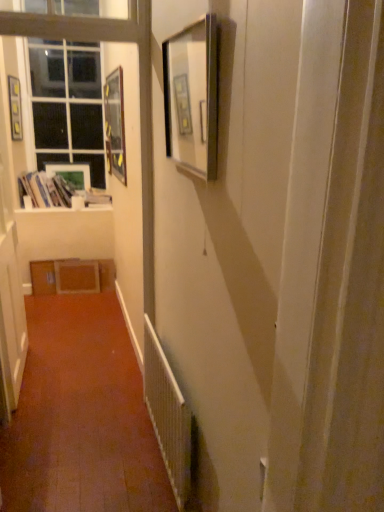
Measure the distance between white textured radiator at lower center and camera.

white textured radiator at lower center and camera are 1.67 meters apart.

Measure the distance between point [172,109] and camera.

Point [172,109] is 5.09 feet away from camera.

In the scene shown: What is the approximate height of matte wooden picture frame at upper left, positioned as the 3th picture frame in back-to-front order?

matte wooden picture frame at upper left, positioned as the 3th picture frame in back-to-front order, is 30.47 inches tall.

Measure the distance between point (10,123) and camera.

The depth of point (10,123) is 3.81 meters.

What is the approximate width of clear glass window at upper left?

The width of clear glass window at upper left is 13.43 centimeters.

What do you see at coordinates (67, 104) in the screenshot? Image resolution: width=384 pixels, height=512 pixels. I see `clear glass window at upper left` at bounding box center [67, 104].

Find the location of a particular element. The height and width of the screenshot is (512, 384). white matte door at left is located at coordinates (10, 264).

Image resolution: width=384 pixels, height=512 pixels. Find the location of `white textured radiator at lower center`. white textured radiator at lower center is located at coordinates (168, 416).

From a real-world perspective, is white glossy window sill at upper left positioned above or below matte black picture frame at upper center, arranged as the first picture frame when viewed from the right?

white glossy window sill at upper left is below matte black picture frame at upper center, arranged as the first picture frame when viewed from the right.

At what (x,y) coordinates should I click in order to perform the action: click on window sill lying below the matte black picture frame at upper center, positioned as the fourth picture frame in back-to-front order (from the image's perspective). Please return your answer as a coordinate pair (x, y). The width and height of the screenshot is (384, 512). Looking at the image, I should click on (65, 209).

Is white glossy window sill at upper left next to matte black picture frame at upper center, marked as the 4th picture frame in a left-to-right arrangement?

white glossy window sill at upper left is not next to matte black picture frame at upper center, marked as the 4th picture frame in a left-to-right arrangement, and they're not touching.

Is white glossy window sill at upper left wider or thinner than matte black picture frame at upper center, arranged as the first picture frame when viewed from the right?

white glossy window sill at upper left is wider than matte black picture frame at upper center, arranged as the first picture frame when viewed from the right.

Considering the sizes of objects matte black picture frame at upper left, the third picture frame when ordered from front to back, and matte black picture frame at upper center, arranged as the first picture frame when viewed from the right, in the image provided, who is taller, matte black picture frame at upper left, the third picture frame when ordered from front to back, or matte black picture frame at upper center, arranged as the first picture frame when viewed from the right,?

matte black picture frame at upper left, the third picture frame when ordered from front to back.

Is matte black picture frame at upper left, the third picture frame when ordered from front to back, completely or partially outside of matte black picture frame at upper center, marked as the 4th picture frame in a left-to-right arrangement?

Yes.

Is matte black picture frame at upper left, the third picture frame when ordered from front to back, wider or thinner than matte black picture frame at upper center, positioned as the fourth picture frame in back-to-front order?

In the image, matte black picture frame at upper left, the third picture frame when ordered from front to back, appears to be more narrow than matte black picture frame at upper center, positioned as the fourth picture frame in back-to-front order.

From the image's perspective, which one is positioned lower, matte wooden picture frame at upper left, the third picture frame positioned from the left, or white paper stack at left?

white paper stack at left.

Which of these two, matte wooden picture frame at upper left, marked as the 2th picture frame in a front-to-back arrangement, or white paper stack at left, is smaller?

matte wooden picture frame at upper left, marked as the 2th picture frame in a front-to-back arrangement.

Consider the image. From a real-world perspective, is matte wooden picture frame at upper left, which ranks as the second picture frame in right-to-left order, under white paper stack at left?

No, from a real-world perspective, matte wooden picture frame at upper left, which ranks as the second picture frame in right-to-left order, is not under white paper stack at left.

Is matte wooden picture frame at upper left, which ranks as the second picture frame in right-to-left order, positioned far away from white paper stack at left?

That's not correct — matte wooden picture frame at upper left, which ranks as the second picture frame in right-to-left order, is a little close to white paper stack at left.

From the image's perspective, is matte wooden picture frame at upper left, the 2th picture frame viewed from the left, above or below clear glass window at upper left?

From the image's perspective, matte wooden picture frame at upper left, the 2th picture frame viewed from the left, appears below clear glass window at upper left.

Where is `picture frame behind the clear glass window at upper left`? picture frame behind the clear glass window at upper left is located at coordinates (71, 174).

Between matte wooden picture frame at upper left, the 3th picture frame from the right, and clear glass window at upper left, which one has larger size?

clear glass window at upper left is bigger.

Which object is further away from the camera, matte wooden picture frame at upper left, which is the fourth picture frame from front to back, or clear glass window at upper left?

matte wooden picture frame at upper left, which is the fourth picture frame from front to back, is more distant.

Between point (63, 208) and point (26, 193), which one is positioned in front?

Point (26, 193)

Is white glossy window sill at upper left oriented away from white paper stack at left?

No, white glossy window sill at upper left is not facing the opposite direction of white paper stack at left.

Where is `window sill that appears on the right of white paper stack at left`? The image size is (384, 512). window sill that appears on the right of white paper stack at left is located at coordinates (65, 209).

Is white glossy window sill at upper left located outside white paper stack at left?

Indeed, white glossy window sill at upper left is completely outside white paper stack at left.

From the image's perspective, is clear glass window at upper left beneath matte wooden picture frame at upper left, the 2th picture frame viewed from the left?

Incorrect, from the image's perspective, clear glass window at upper left is higher than matte wooden picture frame at upper left, the 2th picture frame viewed from the left.

Could you tell me if clear glass window at upper left is facing matte wooden picture frame at upper left, placed as the first picture frame when sorted from back to front?

Yes, clear glass window at upper left is turned towards matte wooden picture frame at upper left, placed as the first picture frame when sorted from back to front.

Does clear glass window at upper left have a greater height compared to matte wooden picture frame at upper left, the 2th picture frame viewed from the left?

Yes.

Is clear glass window at upper left not close to matte wooden picture frame at upper left, placed as the first picture frame when sorted from back to front?

No, clear glass window at upper left is not far away from matte wooden picture frame at upper left, placed as the first picture frame when sorted from back to front.

From a real-world perspective, which is physically above, clear glass window at upper left or white glossy window sill at upper left?

In real-world perspective, clear glass window at upper left is above.

From the image's perspective, is clear glass window at upper left located above or below white glossy window sill at upper left?

clear glass window at upper left is above white glossy window sill at upper left.

What's the angular difference between clear glass window at upper left and white glossy window sill at upper left's facing directions?

The facing directions of clear glass window at upper left and white glossy window sill at upper left are 0.469 degrees apart.

Based on the photo, who is shorter, clear glass window at upper left or white glossy window sill at upper left?

white glossy window sill at upper left is shorter.

I want to click on window sill below the matte black picture frame at upper center, arranged as the first picture frame when viewed from the right (from the image's perspective), so click(65, 209).

You are a GUI agent. You are given a task and a screenshot of the screen. Output one action in this format:
    pyautogui.click(x=<x>, y=<y>)
    Task: Click on the 3rd picture frame above the matte black picture frame at upper center, arranged as the first picture frame when viewed from the right (from the image's perspective)
    The height and width of the screenshot is (512, 384).
    Given the screenshot: What is the action you would take?
    pyautogui.click(x=15, y=108)

Considering their positions, is clear glass window at upper left positioned closer to white paper stack at left than white glossy window sill at upper left?

The object closer to white paper stack at left is white glossy window sill at upper left.

From the picture: Estimate the real-world distances between objects in this image. Which object is closer to white textured radiator at lower center, white glossy window sill at upper left or clear glass window at upper left?

Among the two, white glossy window sill at upper left is located nearer to white textured radiator at lower center.

When comparing their distances from matte wooden picture frame at upper left, the 3th picture frame from the right, does white paper stack at left or clear glass window at upper left seem closer?

Based on the image, white paper stack at left appears to be nearer to matte wooden picture frame at upper left, the 3th picture frame from the right.

Considering their positions, is clear glass window at upper left positioned closer to matte black picture frame at upper left, which ranks as the second picture frame in back-to-front order, than matte wooden picture frame at upper left, placed as the first picture frame when sorted from back to front?

clear glass window at upper left.

Looking at the image, which one is located closer to matte black picture frame at upper left, the third picture frame when ordered from front to back, matte black picture frame at upper center, marked as the 4th picture frame in a left-to-right arrangement, or matte wooden picture frame at upper left, the third picture frame positioned from the left?

The object closer to matte black picture frame at upper left, the third picture frame when ordered from front to back, is matte wooden picture frame at upper left, the third picture frame positioned from the left.

Based on their spatial positions, is white textured radiator at lower center or matte wooden picture frame at upper left, which is the fourth picture frame from front to back, closer to white glossy window sill at upper left?

The object closer to white glossy window sill at upper left is matte wooden picture frame at upper left, which is the fourth picture frame from front to back.

From the image, which object appears to be farther from white textured radiator at lower center, matte wooden picture frame at upper left, the 2th picture frame viewed from the left, or matte black picture frame at upper left, which ranks as the second picture frame in back-to-front order?

Among the two, matte black picture frame at upper left, which ranks as the second picture frame in back-to-front order, is located further to white textured radiator at lower center.

Which object lies nearer to the anchor point clear glass window at upper left, matte wooden picture frame at upper left, the 2th picture frame viewed from the left, or white matte door at left?

matte wooden picture frame at upper left, the 2th picture frame viewed from the left.

This screenshot has width=384, height=512. What are the coordinates of `radiator between matte black picture frame at upper center, marked as the 4th picture frame in a left-to-right arrangement, and clear glass window at upper left, along the z-axis` in the screenshot? It's located at 168,416.

Where is `door between white textured radiator at lower center and clear glass window at upper left from front to back`? The width and height of the screenshot is (384, 512). door between white textured radiator at lower center and clear glass window at upper left from front to back is located at coordinates (10, 264).

Where is `door positioned between white textured radiator at lower center and matte wooden picture frame at upper left, which is the fourth picture frame from front to back, from near to far`? The height and width of the screenshot is (512, 384). door positioned between white textured radiator at lower center and matte wooden picture frame at upper left, which is the fourth picture frame from front to back, from near to far is located at coordinates (10, 264).

Where is `picture frame between white matte door at left and matte black picture frame at upper left, the third picture frame when ordered from front to back, from front to back`? picture frame between white matte door at left and matte black picture frame at upper left, the third picture frame when ordered from front to back, from front to back is located at coordinates (115, 125).